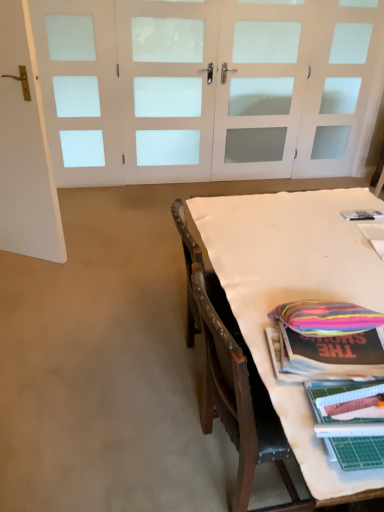
Find the location of a particular element. The image size is (384, 512). empty space that is ontop of white fabric-covered table at lower right (from a real-world perspective) is located at coordinates (307, 242).